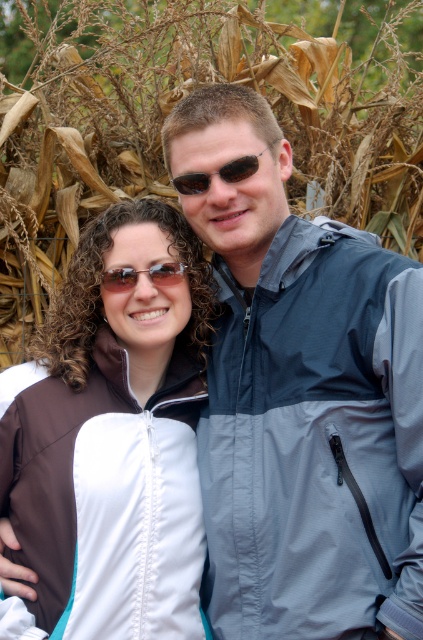
You are trying to decide which pair of sunglasses to take with you on a hike. You see both the brown textured sunglasses at center and the brown reflective sunglasses at center in the image. Based on their positions in the image, which one is located to the right?

The brown textured sunglasses at center is to the right of brown reflective sunglasses at center, so the brown textured sunglasses at center is located to the right.

You are a photographer trying to capture a closeup of the woman in the image. You notice two points marked in the scene. Which point, point [255,154] or point [180,282], is closer to your camera lens?

Point [255,154] is closer to the camera lens than point [180,282].